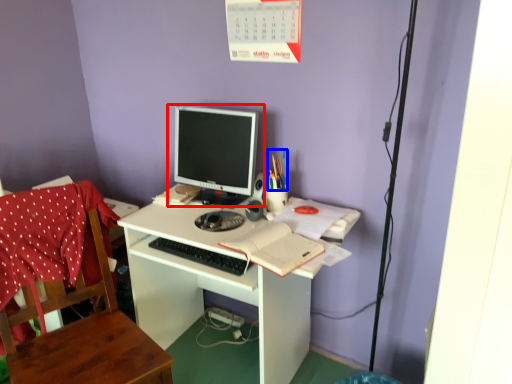
Question: Which of the following is the closest to the observer, computer monitor (highlighted by a red box) or stationery (highlighted by a blue box)?

Choices:
 (A) computer monitor
 (B) stationery

Answer: (A)